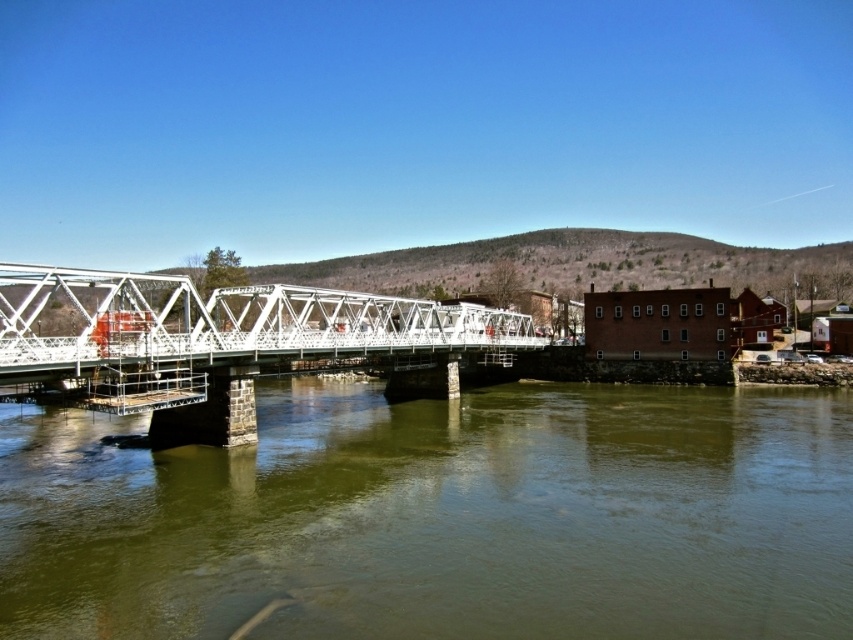
You are a delivery drone with a 1.5 meter wingspan. You need to fly from the red brick building on the right to the white truss bridge at center. Is there enough space between the red brick building on the right and the green murky water at center for you to pass through?

The distance between the red brick building on the right and the green murky water at center is 29.12 meters, which is significantly wider than the drone wingspan of 1.5 meters. Yes, there is enough space for the drone to pass through safely.

You are a tourist standing on the left side of the white metallic bridge at center. You want to take a photo of the green murky water at center without the bridge blocking the view. Which direction should you move to ensure the bridge doesn not block your view?

The green murky water at center is to the right of the white metallic bridge at center. To avoid the bridge blocking the view, you should move to the right side of the bridge so that the water is positioned to your left, away from the bridge structure.

You are a drone operator trying to capture the white metallic bridge at center from above. You notice the green murky water at center below. Will the water be visible beneath the bridge in your aerial photo?

The green murky water at center has a lesser height compared to white metallic bridge at center, so yes, the water will be visible beneath the bridge in the aerial photo since it is lower in height than the bridge structure.